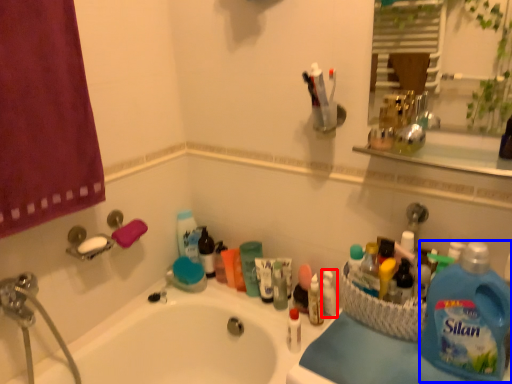
Question: Which object is further to the camera taking this photo, toiletry (highlighted by a red box) or cleaning product (highlighted by a blue box)?

Choices:
 (A) toiletry
 (B) cleaning product

Answer: (A)